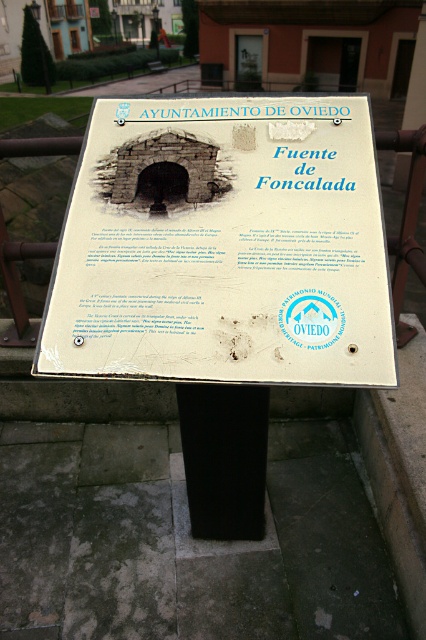
Question: Is white plastic sign at center thinner than black matte pole at center?

Choices:
 (A) no
 (B) yes

Answer: (A)

Question: Which of the following is the closest to the observer?

Choices:
 (A) (160, 122)
 (B) (238, 406)

Answer: (B)

Question: Is white plastic sign at center positioned before black matte pole at center?

Choices:
 (A) no
 (B) yes

Answer: (B)

Question: Does white plastic sign at center have a smaller size compared to black matte pole at center?

Choices:
 (A) no
 (B) yes

Answer: (A)

Question: Among these points, which one is nearest to the camera?

Choices:
 (A) 245,516
 (B) 270,332

Answer: (B)